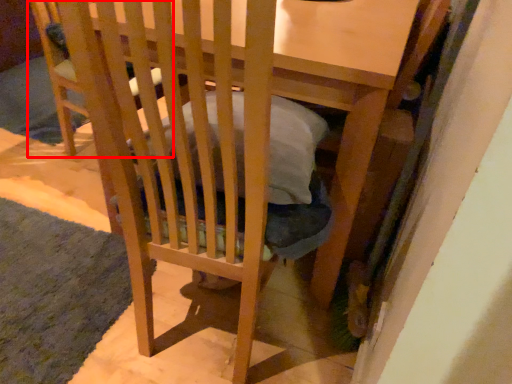
Question: Where is folding chair (annotated by the red box) located in relation to mat in the image?

Choices:
 (A) left
 (B) right

Answer: (B)